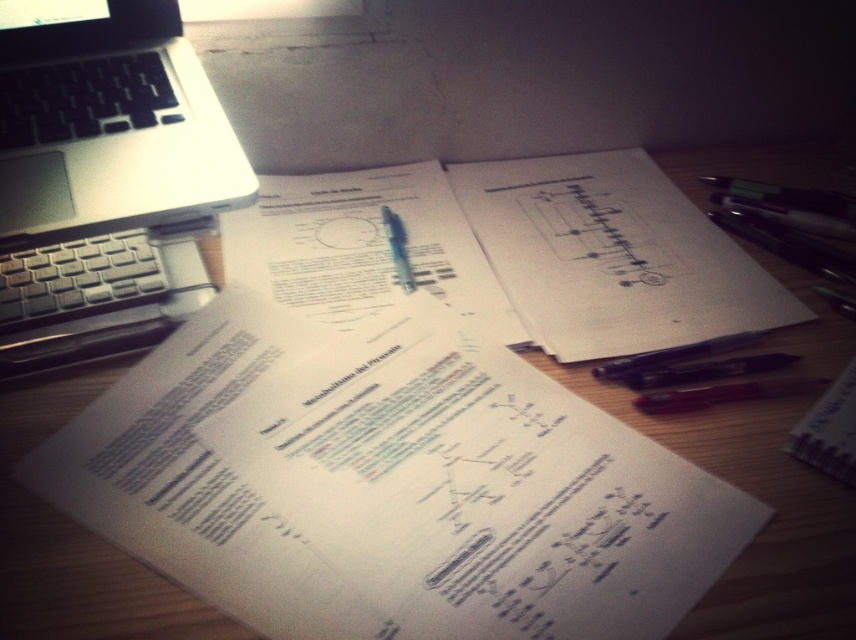
Is silver metallic laptop at upper left closer to the viewer compared to red matte pen at lower right?

Yes, silver metallic laptop at upper left is in front of red matte pen at lower right.

Who is positioned more to the left, silver metallic laptop at upper left or red matte pen at lower right?

From the viewer's perspective, silver metallic laptop at upper left appears more on the left side.

The height and width of the screenshot is (640, 856). I want to click on silver metallic laptop at upper left, so click(104, 179).

Does silver metallic laptop at upper left lie behind white paper at center?

No, silver metallic laptop at upper left is closer to the viewer.

This screenshot has height=640, width=856. What are the coordinates of `silver metallic laptop at upper left` in the screenshot? It's located at (104, 179).

Where is `silver metallic laptop at upper left`? The height and width of the screenshot is (640, 856). silver metallic laptop at upper left is located at coordinates (104, 179).

How much distance is there between white paper at center and red matte pen at lower right?

8.36 inches

Find the location of a particular element. white paper at center is located at coordinates (611, 256).

Find the location of `white paper at center`. white paper at center is located at coordinates (611, 256).